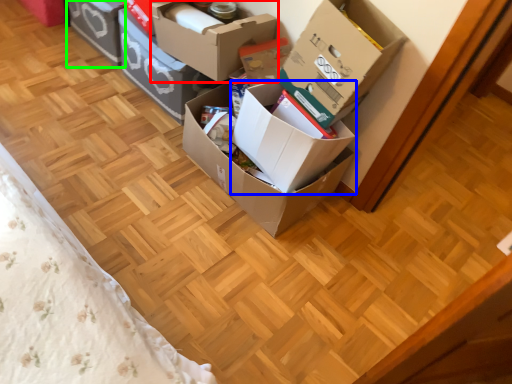
Question: Considering the real-world distances, which object is farthest from box (highlighted by a red box)? box (highlighted by a blue box) or box (highlighted by a green box)?

Choices:
 (A) box
 (B) box

Answer: (B)